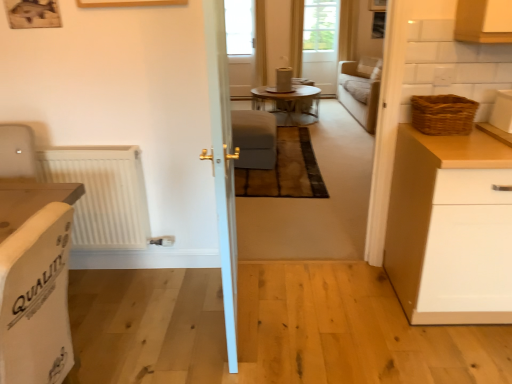
Question: From the image's perspective, would you say transparent glass window at center is positioned over woven brown basket at right?

Choices:
 (A) yes
 (B) no

Answer: (A)

Question: Is woven brown basket at right completely or partially inside transparent glass window at center?

Choices:
 (A) no
 (B) yes

Answer: (A)

Question: Is transparent glass window at center with woven brown basket at right?

Choices:
 (A) no
 (B) yes

Answer: (A)

Question: Is transparent glass window at center not inside woven brown basket at right?

Choices:
 (A) no
 (B) yes

Answer: (B)

Question: Can you confirm if transparent glass window at center is positioned to the right of woven brown basket at right?

Choices:
 (A) no
 (B) yes

Answer: (A)

Question: Considering the positions of white glossy door at center and white ribbed radiator at left in the image, is white glossy door at center bigger or smaller than white ribbed radiator at left?

Choices:
 (A) big
 (B) small

Answer: (A)

Question: From the image's perspective, is white glossy door at center above or below white ribbed radiator at left?

Choices:
 (A) below
 (B) above

Answer: (B)

Question: Relative to white ribbed radiator at left, is white glossy door at center in front or behind?

Choices:
 (A) front
 (B) behind

Answer: (A)

Question: Is white glossy door at center to the left or to the right of white ribbed radiator at left in the image?

Choices:
 (A) right
 (B) left

Answer: (A)

Question: Looking at their shapes, would you say wooden glass table at center is wider or thinner than translucent glass screen door at upper center?

Choices:
 (A) thin
 (B) wide

Answer: (B)

Question: Considering their positions, is wooden glass table at center located in front of or behind translucent glass screen door at upper center?

Choices:
 (A) front
 (B) behind

Answer: (A)

Question: Would you say wooden glass table at center is to the left or to the right of translucent glass screen door at upper center in the picture?

Choices:
 (A) right
 (B) left

Answer: (B)

Question: From the image's perspective, is wooden glass table at center positioned above or below translucent glass screen door at upper center?

Choices:
 (A) above
 (B) below

Answer: (B)

Question: In terms of height, does white glossy container at upper right, arranged as the second appliance when viewed from the top, look taller or shorter compared to white matte cabinet at right?

Choices:
 (A) short
 (B) tall

Answer: (A)

Question: From a real-world perspective, is white glossy container at upper right, the 1th appliance when ordered from bottom to top, physically located above or below white matte cabinet at right?

Choices:
 (A) above
 (B) below

Answer: (A)